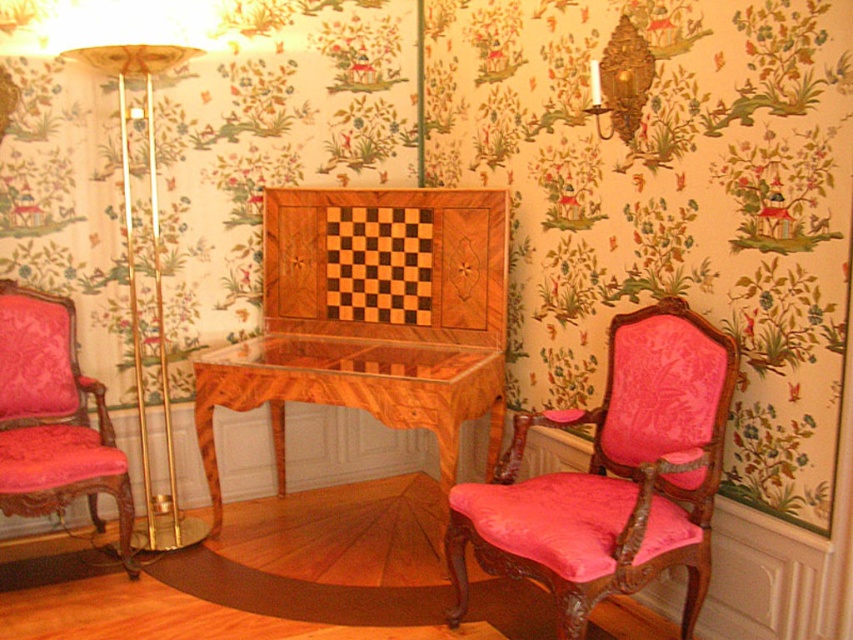
Is wooden table at center below gold metallic floor lamp at left?

Yes.

Does wooden table at center come in front of gold metallic floor lamp at left?

Yes, it is.

Who is more forward, (242, 385) or (151, 54)?

Point (151, 54) is more forward.

Identify the location of wooden table at center. Image resolution: width=853 pixels, height=640 pixels. (351, 390).

Can you confirm if pink velvet armchair at right is bigger than wooden table at center?

Actually, pink velvet armchair at right might be smaller than wooden table at center.

The image size is (853, 640). Describe the element at coordinates (613, 477) in the screenshot. I see `pink velvet armchair at right` at that location.

Image resolution: width=853 pixels, height=640 pixels. What do you see at coordinates (613, 477) in the screenshot?
I see `pink velvet armchair at right` at bounding box center [613, 477].

Image resolution: width=853 pixels, height=640 pixels. I want to click on pink velvet armchair at right, so click(613, 477).

This screenshot has height=640, width=853. What do you see at coordinates (613, 477) in the screenshot?
I see `pink velvet armchair at right` at bounding box center [613, 477].

Which is behind, point (618, 353) or point (61, 353)?

Positioned behind is point (61, 353).

Is point (554, 476) farther from viewer compared to point (131, 566)?

No, (554, 476) is closer to viewer.

The image size is (853, 640). I want to click on pink velvet armchair at right, so click(x=613, y=477).